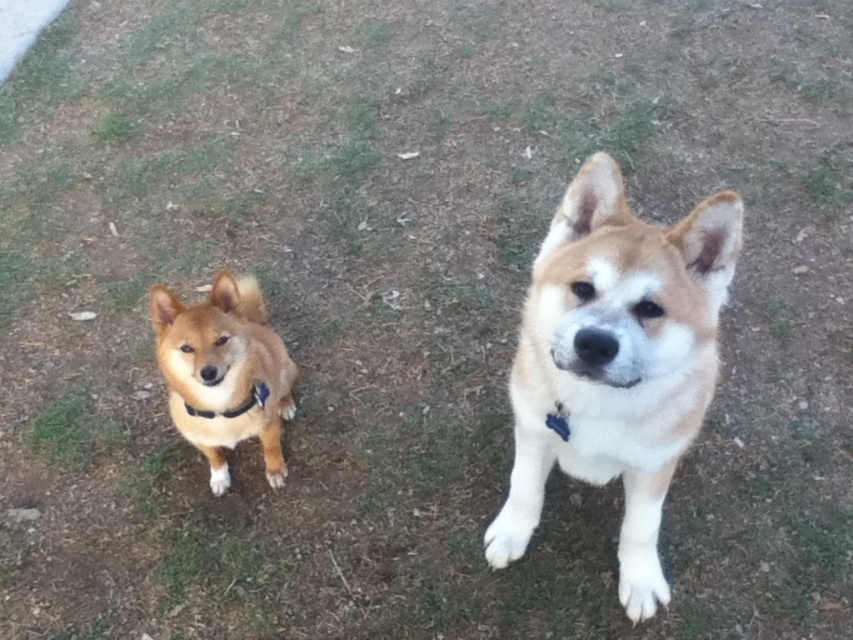
You are a photographer setting up a camera to capture both the light brown fur dog at center and the black fabric neckband at lower left in the same frame. Which object is wider so you can adjust your camera angle accordingly?

The light brown fur dog at center is wider than the black fabric neckband at lower left, so you should adjust your camera angle to accommodate its larger width.

You are a photographer setting up a tripod to take a picture of the light brown fur dog at center and the black fabric neckband at lower left. The tripod requires both subjects to be in the same frame. Based on their positions, can you confirm if they are positioned side by side horizontally?

The light brown fur dog at center is to the right of the black fabric neckband at lower left, so they are positioned side by side horizontally and can be captured in the same frame.

You are a dog trainer assessing the space between two dogs in the image. The light brown fur dog at center and the brown fur dog at left are both standing on the grass. If you want to place a 1.2 meter wide exercise mat between them, will there be enough space?

The light brown fur dog at center is narrower than the brown fur dog at left. However, the exact distance between them isn